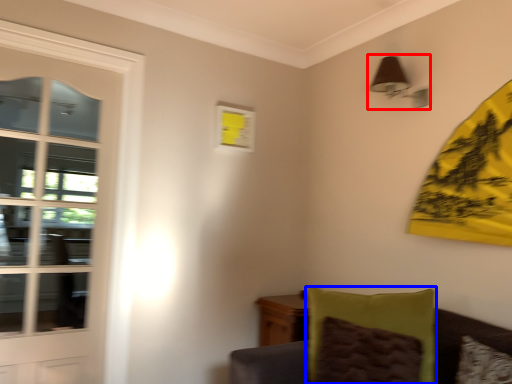
Question: Among these objects, which one is nearest to the camera, light fixture (highlighted by a red box) or pillow (highlighted by a blue box)?

Choices:
 (A) light fixture
 (B) pillow

Answer: (B)